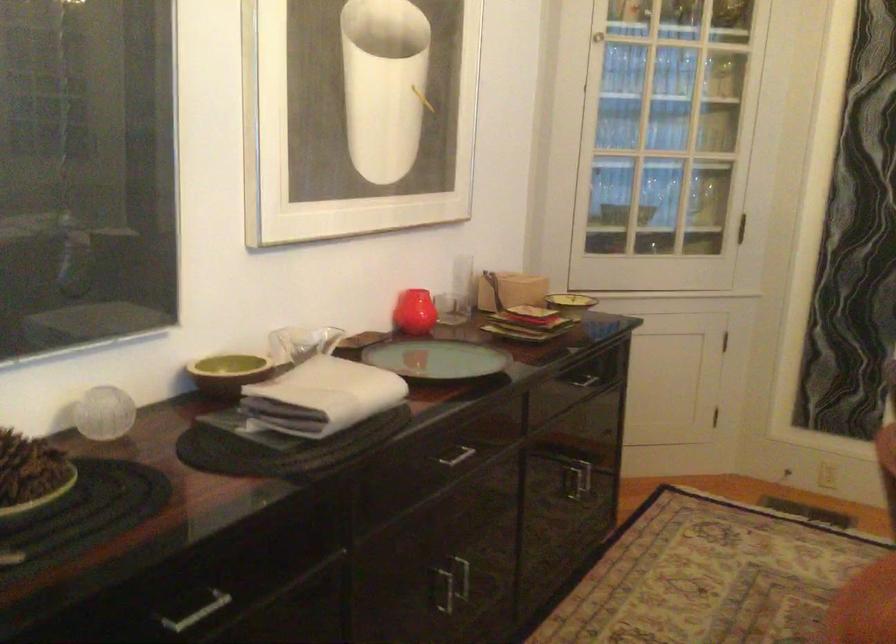
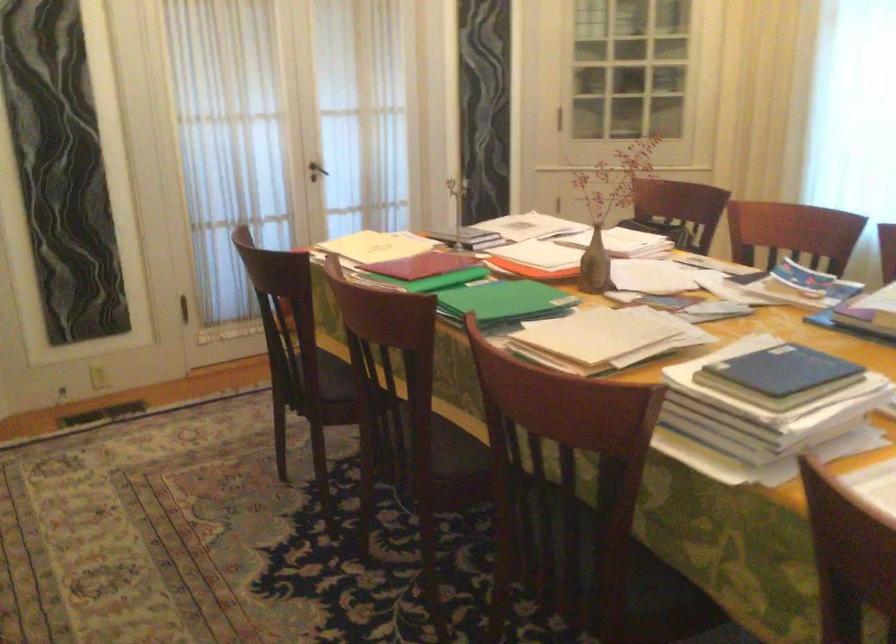
Question: The first image is from the beginning of the video and the second image is from the end. How did the camera likely rotate when shooting the video?

Choices:
 (A) Left
 (B) Right
 (C) Up
 (D) Down

Answer: (B)